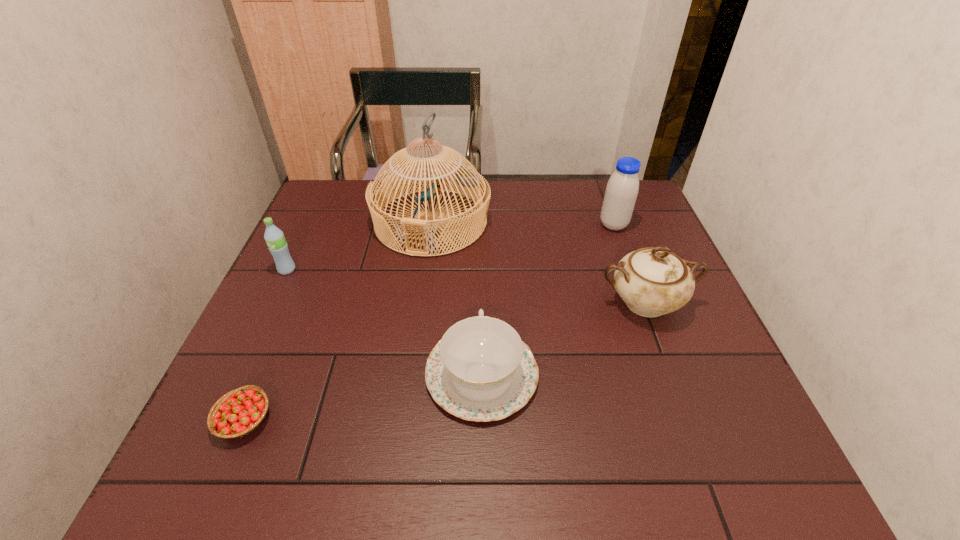
What are the coordinates of `object that stands as the fifth closest to the birdcage` in the screenshot? It's located at (239, 412).

Locate an element on the screen. Image resolution: width=960 pixels, height=540 pixels. vacant region that satisfies the following two spatial constraints: 1. on the back side of the birdcage; 2. on the left side of the strawberry is located at coordinates (328, 222).